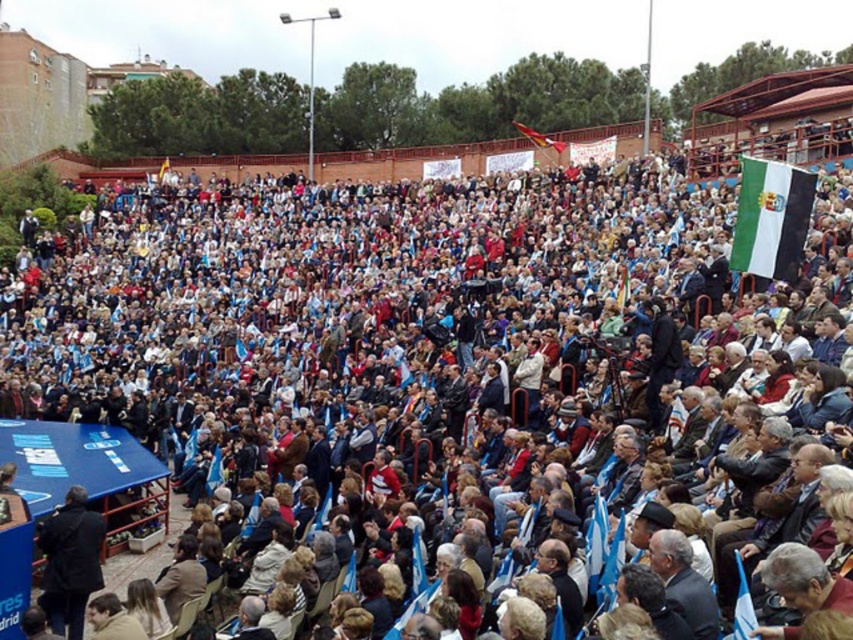
You are a photographer at the event and want to capture both the white and black fabric flag at upper right and the white fabric flag at center in a single shot. Which flag should you focus on to ensure both are in frame without zooming in?

You should focus on the white fabric flag at center because the white and black fabric flag at upper right is smaller, allowing both to fit within the frame without needing to zoom in.

You are a photographer at the event and want to capture both the white and black fabric flag at upper right and the white fabric flag at center in a single shot. Which flag should you focus on to ensure both are visible without zooming in or out?

You should focus on the white fabric flag at center because it has a greater width than the white and black fabric flag at upper right, making it more likely to remain visible in the frame without needing to adjust the zoom.